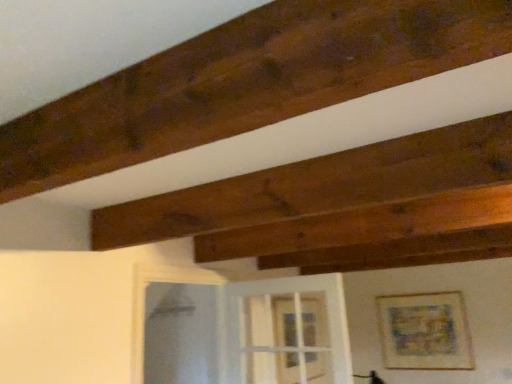
Measure the distance between point [462,315] and camera.

The distance of point [462,315] from camera is 4.10 meters.

The image size is (512, 384). What do you see at coordinates (181, 334) in the screenshot? I see `clear glass screen door at lower center` at bounding box center [181, 334].

Find the location of a particular element. The width and height of the screenshot is (512, 384). matte wooden picture frame at upper right is located at coordinates (424, 332).

Considering their positions, is transparent glass door at center located in front of or behind clear glass screen door at lower center?

In the image, transparent glass door at center appears behind clear glass screen door at lower center.

Is transparent glass door at center smaller than clear glass screen door at lower center?

Yes, transparent glass door at center is smaller than clear glass screen door at lower center.

Would you say transparent glass door at center is a long distance from clear glass screen door at lower center?

transparent glass door at center is positioned a significant distance from clear glass screen door at lower center.

From a real-world perspective, is transparent glass door at center over clear glass screen door at lower center?

No, from a real-world perspective, transparent glass door at center is not over clear glass screen door at lower center

Can you confirm if clear glass screen door at lower center is thinner than transparent glass door at center?

No.

Is transparent glass door at center completely or partially inside clear glass screen door at lower center?

No, transparent glass door at center is not a part of clear glass screen door at lower center.

Is clear glass screen door at lower center far from transparent glass door at center?

That's right, there is a large distance between clear glass screen door at lower center and transparent glass door at center.

Which is in front, matte wooden picture frame at upper right or transparent glass door at center?

transparent glass door at center is more forward.

Does matte wooden picture frame at upper right have a greater height compared to transparent glass door at center?

Yes, matte wooden picture frame at upper right is taller than transparent glass door at center.

From the image's perspective, which object appears higher, matte wooden picture frame at upper right or transparent glass door at center?

transparent glass door at center, from the image's perspective.

Which point is more forward, (390,312) or (301,312)?

Point (301,312)

From a real-world perspective, is transparent glass door at center positioned under matte wooden picture frame at upper right based on gravity?

Incorrect, from a real-world perspective, transparent glass door at center is higher than matte wooden picture frame at upper right.

Is transparent glass door at center inside or outside of matte wooden picture frame at upper right?

transparent glass door at center exists outside the volume of matte wooden picture frame at upper right.

From the image's perspective, which is below, transparent glass door at center or matte wooden picture frame at upper right?

From the image's view, matte wooden picture frame at upper right is below.

Based on the photo, which of these two, clear glass screen door at lower center or matte wooden picture frame at upper right, is bigger?

With larger size is clear glass screen door at lower center.

From a real-world perspective, which is physically below, clear glass screen door at lower center or matte wooden picture frame at upper right?

In real-world perspective, matte wooden picture frame at upper right is lower.

Is clear glass screen door at lower center in front of or behind matte wooden picture frame at upper right in the image?

Visually, clear glass screen door at lower center is located in front of matte wooden picture frame at upper right.

Is matte wooden picture frame at upper right bigger than clear glass screen door at lower center?

No, matte wooden picture frame at upper right is not bigger than clear glass screen door at lower center.

Considering the sizes of objects matte wooden picture frame at upper right and clear glass screen door at lower center in the image provided, who is thinner, matte wooden picture frame at upper right or clear glass screen door at lower center?

matte wooden picture frame at upper right is thinner.

How distant is matte wooden picture frame at upper right from clear glass screen door at lower center?

6.86 feet.

Considering the sizes of objects matte wooden picture frame at upper right and clear glass screen door at lower center in the image provided, who is taller, matte wooden picture frame at upper right or clear glass screen door at lower center?

With more height is clear glass screen door at lower center.

I want to click on screen door that is above the transparent glass door at center (from a real-world perspective), so click(x=181, y=334).

You are a GUI agent. You are given a task and a screenshot of the screen. Output one action in this format:
    pyautogui.click(x=<x>, y=<y>)
    Task: Click on the glass door on the right of clear glass screen door at lower center
    
    Given the screenshot: What is the action you would take?
    pyautogui.click(x=313, y=323)

When comparing their distances from transparent glass door at center, does clear glass screen door at lower center or matte wooden picture frame at upper right seem further?

clear glass screen door at lower center lies further to transparent glass door at center than the other object.

Estimate the real-world distances between objects in this image. Which object is closer to clear glass screen door at lower center, matte wooden picture frame at upper right or transparent glass door at center?

Among the two, transparent glass door at center is located nearer to clear glass screen door at lower center.

When comparing their distances from transparent glass door at center, does matte wooden picture frame at upper right or clear glass screen door at lower center seem closer?

matte wooden picture frame at upper right.

When comparing their distances from matte wooden picture frame at upper right, does transparent glass door at center or clear glass screen door at lower center seem closer?

Based on the image, transparent glass door at center appears to be nearer to matte wooden picture frame at upper right.

From the image, which object appears to be nearer to matte wooden picture frame at upper right, clear glass screen door at lower center or transparent glass door at center?

The object closer to matte wooden picture frame at upper right is transparent glass door at center.

From the image, which object appears to be nearer to clear glass screen door at lower center, transparent glass door at center or matte wooden picture frame at upper right?

transparent glass door at center is positioned closer to the anchor clear glass screen door at lower center.

Where is `glass door situated between clear glass screen door at lower center and matte wooden picture frame at upper right from left to right`? glass door situated between clear glass screen door at lower center and matte wooden picture frame at upper right from left to right is located at coordinates (313, 323).